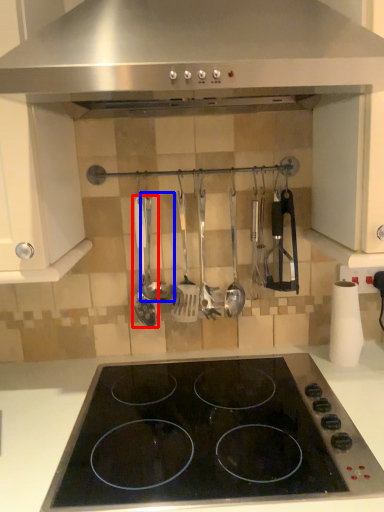
Question: Which of the following is the closest to the observer, spatula (highlighted by a red box) or utensil (highlighted by a blue box)?

Choices:
 (A) spatula
 (B) utensil

Answer: (B)